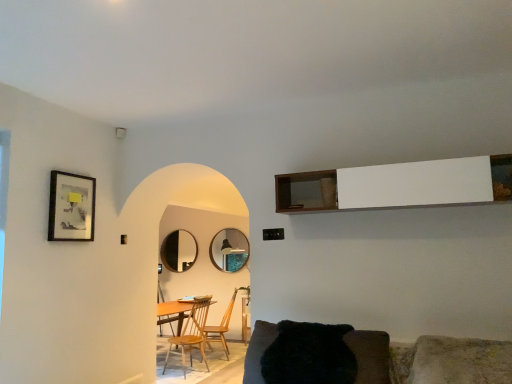
Question: Which direction should I rotate to look at matte black mirror at center, which is the 1th mirror in back-to-front order?

Choices:
 (A) left
 (B) right

Answer: (A)

Question: From a real-world perspective, is matte silver mirror at center, which is the second mirror in left-to-right order, positioned over black furry chair at lower center, placed as the first chair when sorted from right to left, based on gravity?

Choices:
 (A) yes
 (B) no

Answer: (A)

Question: Considering the relative sizes of matte silver mirror at center, which is the second mirror in left-to-right order, and black furry chair at lower center, which is counted as the 1th chair, starting from the front, in the image provided, is matte silver mirror at center, which is the second mirror in left-to-right order, thinner than black furry chair at lower center, which is counted as the 1th chair, starting from the front,?

Choices:
 (A) yes
 (B) no

Answer: (A)

Question: Considering the relative sizes of matte silver mirror at center, which is the second mirror from back to front, and black furry chair at lower center, which appears as the third chair when viewed from the left, in the image provided, is matte silver mirror at center, which is the second mirror from back to front, smaller than black furry chair at lower center, which appears as the third chair when viewed from the left,?

Choices:
 (A) no
 (B) yes

Answer: (B)

Question: Is matte silver mirror at center, the 1th mirror positioned from the front, shorter than black furry chair at lower center, which is counted as the 1th chair, starting from the front?

Choices:
 (A) no
 (B) yes

Answer: (A)

Question: Considering the relative positions of matte silver mirror at center, which is the second mirror in left-to-right order, and black furry chair at lower center, which is counted as the 1th chair, starting from the front, in the image provided, is matte silver mirror at center, which is the second mirror in left-to-right order, to the left of black furry chair at lower center, which is counted as the 1th chair, starting from the front, from the viewer's perspective?

Choices:
 (A) no
 (B) yes

Answer: (B)

Question: From the image's perspective, is matte silver mirror at center, the 1th mirror positioned from the front, below black furry chair at lower center, which is counted as the 1th chair, starting from the front?

Choices:
 (A) yes
 (B) no

Answer: (A)

Question: Does white wood cabinet at upper center have a greater width compared to wooden chair at center, the 1th chair viewed from the back?

Choices:
 (A) yes
 (B) no

Answer: (B)

Question: Are white wood cabinet at upper center and wooden chair at center, acting as the second chair starting from the left, making contact?

Choices:
 (A) yes
 (B) no

Answer: (B)

Question: From a real-world perspective, is white wood cabinet at upper center physically below wooden chair at center, acting as the second chair starting from the left?

Choices:
 (A) no
 (B) yes

Answer: (A)

Question: Is white wood cabinet at upper center shorter than wooden chair at center, which is the third chair from front to back?

Choices:
 (A) yes
 (B) no

Answer: (A)

Question: From the image's perspective, does white wood cabinet at upper center appear lower than wooden chair at center, the second chair positioned from the right?

Choices:
 (A) yes
 (B) no

Answer: (B)

Question: From the image's perspective, does white wood cabinet at upper center appear higher than wooden chair at center, the second chair positioned from the right?

Choices:
 (A) yes
 (B) no

Answer: (A)

Question: Is matte black mirror at center, which is counted as the 2th mirror, starting from the front, shorter than matte silver mirror at center, the 1th mirror positioned from the front?

Choices:
 (A) yes
 (B) no

Answer: (A)